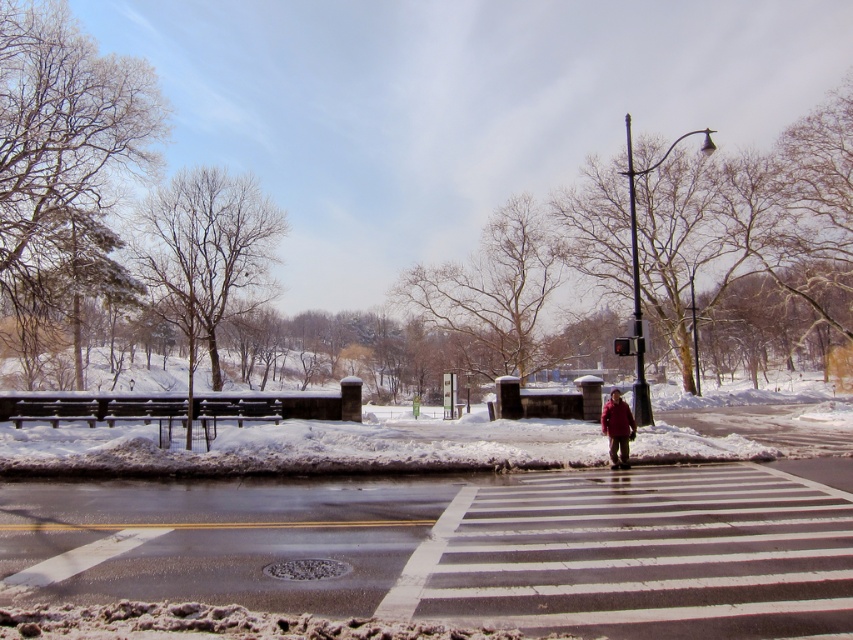
From the picture: Between white painted crosswalk at center and red glass traffic light at center, which one is positioned lower?

white painted crosswalk at center is below.

Can you confirm if white painted crosswalk at center is positioned above red glass traffic light at center?

Actually, white painted crosswalk at center is below red glass traffic light at center.

Which is in front, point (213, 528) or point (622, 353)?

Point (213, 528) is in front.

The height and width of the screenshot is (640, 853). Identify the location of white painted crosswalk at center. (476, 548).

Who is shorter, white painted crosswalk at center or red wool coat at crosswalk?

white painted crosswalk at center is shorter.

Is white painted crosswalk at center to the right of red wool coat at crosswalk from the viewer's perspective?

No, white painted crosswalk at center is not to the right of red wool coat at crosswalk.

Which is behind, point (544, 524) or point (614, 436)?

Point (614, 436)

The image size is (853, 640). What are the coordinates of `white painted crosswalk at center` in the screenshot? It's located at (476, 548).

Does red wool coat at crosswalk have a lesser width compared to red glass traffic light at center?

No.

Based on the photo, is red wool coat at crosswalk positioned before red glass traffic light at center?

That is True.

Where is `red wool coat at crosswalk`? This screenshot has width=853, height=640. red wool coat at crosswalk is located at coordinates (618, 428).